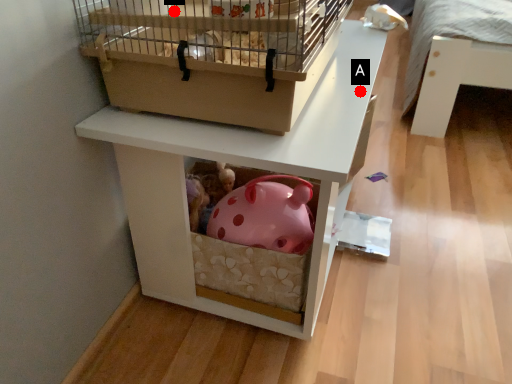
Question: Two points are circled on the image, labeled by A and B beside each circle. Which point is farther to the camera?

Choices:
 (A) A is further
 (B) B is further

Answer: (A)